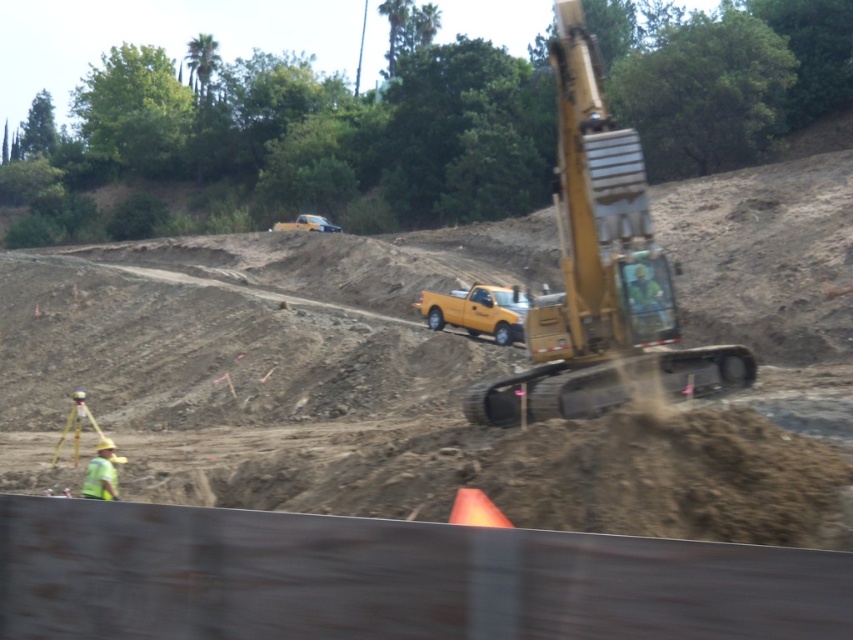
Between yellow metallic excavator at right and yellow hard hat at lower left, which one is positioned lower?

yellow hard hat at lower left is lower down.

Describe the element at coordinates (601, 273) in the screenshot. I see `yellow metallic excavator at right` at that location.

The width and height of the screenshot is (853, 640). I want to click on yellow metallic excavator at right, so click(601, 273).